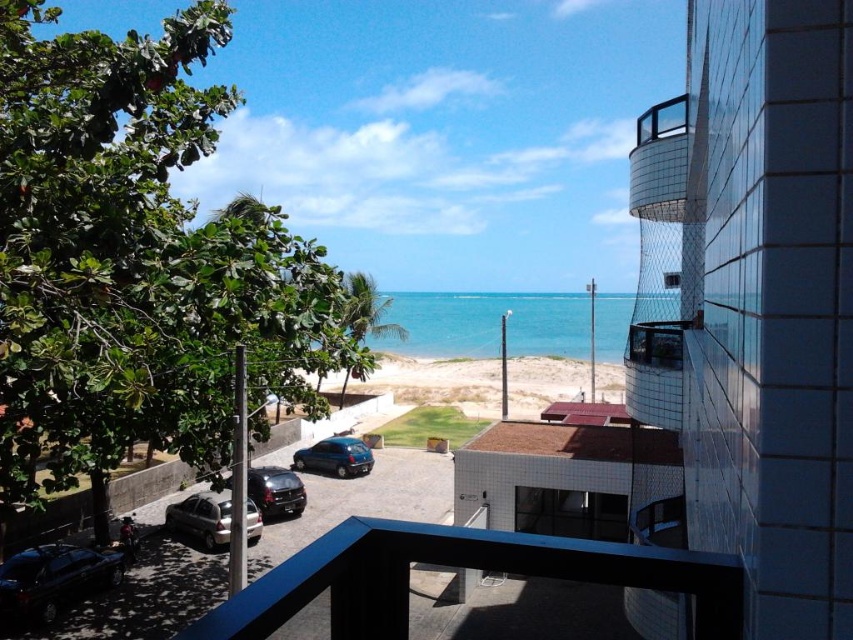
Question: Which point is farther to the camera?

Choices:
 (A) shiny black car at lower left
 (B) shiny dark blue hatchback at center
 (C) beige sand at center
 (D) glossy black suv at lower left

Answer: (C)

Question: Considering the real-world distances, which object is farthest from the glossy black suv at lower left?

Choices:
 (A) shiny black car at lower left
 (B) beige sand at center
 (C) glassy metallic balcony at upper right

Answer: (B)

Question: Is beige sand at center smaller than shiny black car at lower left?

Choices:
 (A) no
 (B) yes

Answer: (A)

Question: Which point appears closest to the camera in this image?

Choices:
 (A) (10, 605)
 (B) (347, 436)

Answer: (A)

Question: Is shiny black car at lower left to the right of shiny dark blue hatchback at center from the viewer's perspective?

Choices:
 (A) no
 (B) yes

Answer: (A)

Question: Is the position of glassy metallic balcony at upper right less distant than that of satin silver car at lower left?

Choices:
 (A) yes
 (B) no

Answer: (A)